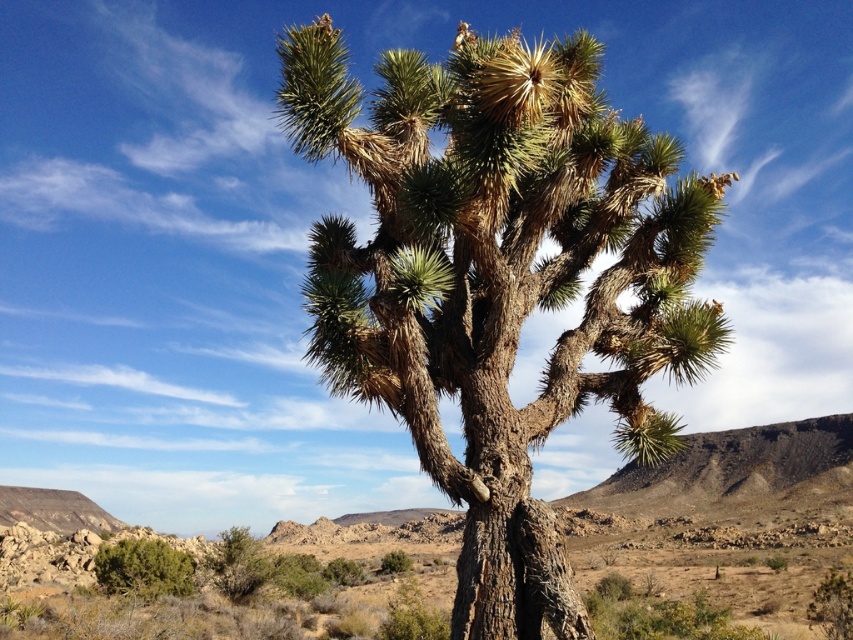
You are standing in the desert and see the green spiny tree at center. If you want to reach the tree, how many steps of 3 feet each would you need to take?

The green spiny tree at center is 30.49 feet away. Each step is 3 feet, so dividing 30.49 by 3 gives approximately 10.16 steps. Since you can take whole steps, you would need to take 11 steps to reach the tree.